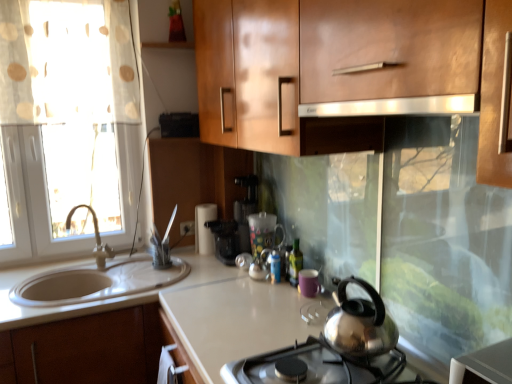
How much space does satin white countertop at center, the 1th countertop when ordered from right to left, occupy horizontally?

satin white countertop at center, the 1th countertop when ordered from right to left, is 70.25 centimeters wide.

What is the approximate width of white glossy countertop at lower left, the 1th countertop positioned from the left?

A: white glossy countertop at lower left, the 1th countertop positioned from the left, is 18.20 inches wide.

The width and height of the screenshot is (512, 384). What are the coordinates of `white glossy countertop at lower left, arranged as the second countertop when viewed from the right` in the screenshot? It's located at [x=58, y=306].

This screenshot has height=384, width=512. What do you see at coordinates (394, 106) in the screenshot? I see `satin silver exhaust hood at upper center` at bounding box center [394, 106].

Image resolution: width=512 pixels, height=384 pixels. I want to click on satin silver exhaust hood at upper center, so [394, 106].

Describe the element at coordinates (95, 238) in the screenshot. The height and width of the screenshot is (384, 512). I see `matte silver faucet at left` at that location.

Find the location of a particular element. This screenshot has width=512, height=384. polished stainless steel kettle at center is located at coordinates click(320, 366).

From the picture: Does matte silver faucet at left have a lesser height compared to satin silver exhaust hood at upper center?

No.

Is matte silver faucet at left inside the boundaries of satin silver exhaust hood at upper center, or outside?

matte silver faucet at left is spatially situated outside satin silver exhaust hood at upper center.

Find the location of a particular element. exhaust hood in front of the matte silver faucet at left is located at coordinates (394, 106).

Can you tell me how much matte silver faucet at left and satin silver exhaust hood at upper center differ in facing direction?

matte silver faucet at left and satin silver exhaust hood at upper center are facing 3.07 degrees away from each other.

Based on the photo, between polished stainless steel kettle at center and glossy wood cabinet at upper center, which one has more height?

Standing taller between the two is glossy wood cabinet at upper center.

From a real-world perspective, is polished stainless steel kettle at center positioned above or below glossy wood cabinet at upper center?

polished stainless steel kettle at center is situated lower than glossy wood cabinet at upper center in the real world.

Is polished stainless steel kettle at center far away from glossy wood cabinet at upper center?

Actually, polished stainless steel kettle at center and glossy wood cabinet at upper center are a little close together.

Could you measure the distance between polished stainless steel kettle at center and glossy wood cabinet at upper center?

They are 29.86 inches apart.

Between green glass bottle at center and white matte paper towel holder at center, the 1th appliance in the left-to-right sequence, which one has smaller width?

With smaller width is green glass bottle at center.

In the scene shown: From the image's perspective, is green glass bottle at center below white matte paper towel holder at center, the 3th appliance viewed from the right?

Yes.

Is green glass bottle at center placed right next to white matte paper towel holder at center, which is the third appliance from front to back?

No, green glass bottle at center is not touching white matte paper towel holder at center, which is the third appliance from front to back.

From a real-world perspective, who is located higher, green glass bottle at center or white matte paper towel holder at center, the 3th appliance viewed from the right?

In real-world perspective, white matte paper towel holder at center, the 3th appliance viewed from the right, is above.

In terms of height, does green glass bottle at center look taller or shorter compared to black plastic coffee machine at center?

Clearly, green glass bottle at center is shorter compared to black plastic coffee machine at center.

Does green glass bottle at center come in front of black plastic coffee machine at center?

Yes, green glass bottle at center is closer to the camera.

From a real-world perspective, who is located lower, green glass bottle at center or black plastic coffee machine at center?

In real-world perspective, green glass bottle at center is lower.

Which object is positioned more to the right, green glass bottle at center or black plastic coffee machine at center?

green glass bottle at center.

Considering the relative sizes of satin silver exhaust hood at upper center and matte silver faucet at left in the image provided, is satin silver exhaust hood at upper center thinner than matte silver faucet at left?

In fact, satin silver exhaust hood at upper center might be wider than matte silver faucet at left.

From the image's perspective, is satin silver exhaust hood at upper center above or below matte silver faucet at left?

Based on their image positions, satin silver exhaust hood at upper center is located above matte silver faucet at left.

Consider the image. Considering the sizes of satin silver exhaust hood at upper center and matte silver faucet at left in the image, is satin silver exhaust hood at upper center bigger or smaller than matte silver faucet at left?

satin silver exhaust hood at upper center is smaller than matte silver faucet at left.

In the scene shown: Can we say satin silver exhaust hood at upper center lies outside matte silver faucet at left?

Indeed, satin silver exhaust hood at upper center is completely outside matte silver faucet at left.

From the image's perspective, between satin white countertop at center, the 1th countertop when ordered from right to left, and green glass bottle at center, which one is located above?

green glass bottle at center appears higher in the image.

From a real-world perspective, which countertop is the 2nd one underneath the green glass bottle at center? Please provide its 2D coordinates.

[(78, 337)]

Is satin white countertop at center, which is counted as the 2th countertop, starting from the left, at the right side of green glass bottle at center?

No.

Does satin white countertop at center, the 1th countertop when ordered from right to left, touch green glass bottle at center?

No, satin white countertop at center, the 1th countertop when ordered from right to left, is not next to green glass bottle at center.

Is matte silver faucet at left not close to polished stainless steel kettle at center?

Yes, matte silver faucet at left is far from polished stainless steel kettle at center.

Consider the image. Which is more to the right, matte silver faucet at left or polished stainless steel kettle at center?

From the viewer's perspective, polished stainless steel kettle at center appears more on the right side.

Based on the photo, who is shorter, matte silver faucet at left or polished stainless steel kettle at center?

Standing shorter between the two is polished stainless steel kettle at center.

Where is `exhaust hood located above the matte silver faucet at left (from a real-world perspective)`? This screenshot has height=384, width=512. exhaust hood located above the matte silver faucet at left (from a real-world perspective) is located at coordinates (394, 106).

I want to click on gas stove that appears below the glossy wood cabinet at upper center (from the image's perspective), so click(x=320, y=366).

Based on the photo, considering their positions, is glossy wood cabinet at upper center positioned closer to purple matte mug at center, the third appliance from the back, than satin white countertop at center, the 1th countertop when ordered from right to left?

satin white countertop at center, the 1th countertop when ordered from right to left.

When comparing their distances from purple matte mug at center, placed as the 1th appliance when sorted from right to left, does white glossy countertop at lower left, the 1th countertop positioned from the left, or glossy wood cabinet at upper center seem further?

Among the two, glossy wood cabinet at upper center is located further to purple matte mug at center, placed as the 1th appliance when sorted from right to left.

Estimate the real-world distances between objects in this image. Which object is closer to purple matte mug at center, placed as the 1th appliance when sorted from right to left, polished stainless steel kettle at center or glossy wood cabinet at upper center?

The object closer to purple matte mug at center, placed as the 1th appliance when sorted from right to left, is polished stainless steel kettle at center.

Looking at the image, which one is located closer to satin silver exhaust hood at upper center, translucent glass mug at center, the second appliance positioned from the right, or glossy wood cabinet at upper center?

Based on the image, glossy wood cabinet at upper center appears to be nearer to satin silver exhaust hood at upper center.

When comparing their distances from matte silver faucet at left, does green glass bottle at center or satin white countertop at center, the 1th countertop when ordered from right to left, seem further?

green glass bottle at center.

Looking at the image, which one is located closer to green glass bottle at center, satin white countertop at center, the 1th countertop when ordered from right to left, or purple matte mug at center, the third appliance from the back?

Based on the image, purple matte mug at center, the third appliance from the back, appears to be nearer to green glass bottle at center.

Based on their spatial positions, is green glass bottle at center or glossy wood cabinet at upper center closer to black plastic coffee machine at center?

Among the two, green glass bottle at center is located nearer to black plastic coffee machine at center.

From the image, which object appears to be farther from purple matte mug at center, placed as the 1th appliance when sorted from right to left, translucent glass mug at center, placed as the second appliance when sorted from left to right, or white glossy countertop at lower left, arranged as the second countertop when viewed from the right?

Based on the image, white glossy countertop at lower left, arranged as the second countertop when viewed from the right, appears to be further to purple matte mug at center, placed as the 1th appliance when sorted from right to left.

Image resolution: width=512 pixels, height=384 pixels. Find the location of `tap positioned between glossy wood cabinet at upper center and translucent glass mug at center, arranged as the 2th appliance when viewed from the back, from near to far`. tap positioned between glossy wood cabinet at upper center and translucent glass mug at center, arranged as the 2th appliance when viewed from the back, from near to far is located at coordinates tap(95, 238).

Locate an element on the screen. appliance positioned between polished stainless steel kettle at center and green glass bottle at center from near to far is located at coordinates (309, 282).

Find the location of a particular element. This screenshot has height=384, width=512. tap between polished stainless steel kettle at center and white matte paper towel holder at center, the 3th appliance viewed from the right, in the front-back direction is located at coordinates (95, 238).

Find the location of a particular element. bottle between polished stainless steel kettle at center and white matte paper towel holder at center, which is counted as the first appliance, starting from the back, along the z-axis is located at coordinates (295, 263).